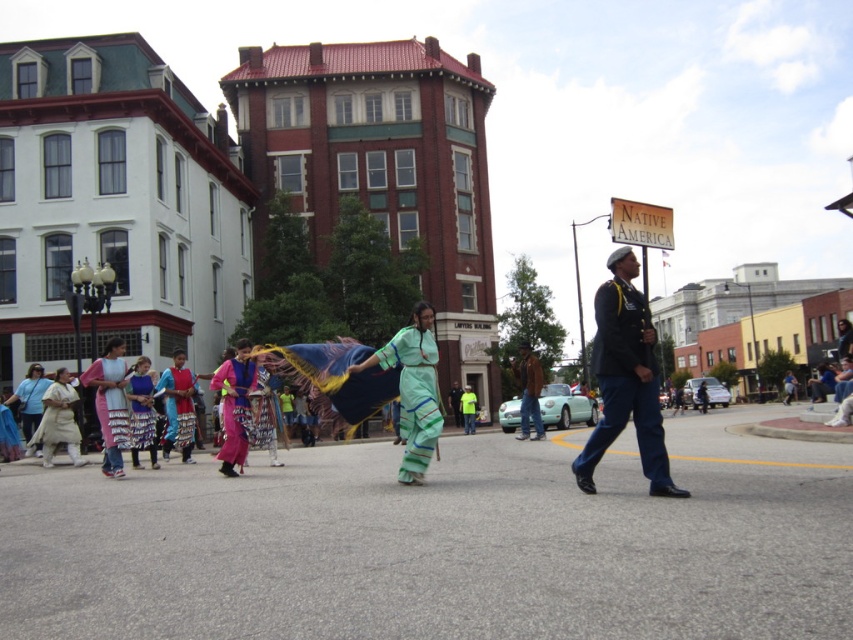
Question: Which of the following is the farthest from the observer?

Choices:
 (A) (405, 372)
 (B) (21, 413)
 (C) (113, 468)

Answer: (B)

Question: Based on their relative distances, which object is nearer to the blue satin dress at center?

Choices:
 (A) matte pink fabric dress at left
 (B) white cotton dress at left

Answer: (B)

Question: Is green fabric dress at center thinner than matte blue dress at center?

Choices:
 (A) yes
 (B) no

Answer: (A)

Question: Which object is closer to the camera taking this photo?

Choices:
 (A) matte green dress at lower left
 (B) dark blue uniform at center

Answer: (B)

Question: Is white cotton dress at left to the left of matte green dress at lower left from the viewer's perspective?

Choices:
 (A) yes
 (B) no

Answer: (B)

Question: Is dark blue uniform at center to the left of white cotton dress at left from the viewer's perspective?

Choices:
 (A) yes
 (B) no

Answer: (B)